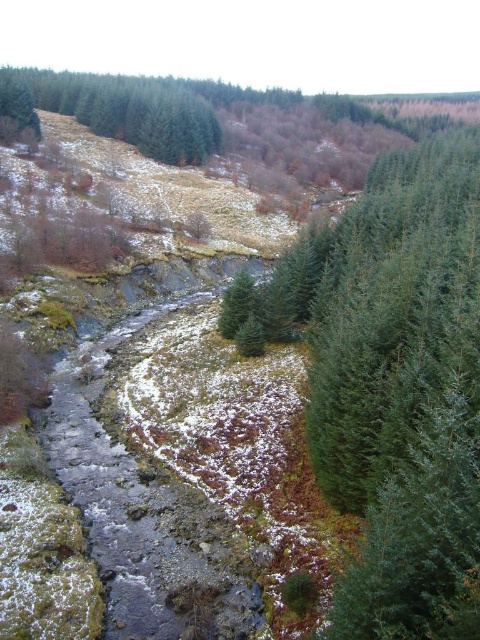
Is green needle-like tree at center-right above green matte tree at upper left?

No, green needle-like tree at center-right is not above green matte tree at upper left.

Is point (436, 413) farther from camera compared to point (36, 72)?

No.

Is point (432, 346) positioned behind point (216, 132)?

No, it is in front of (216, 132).

Identify the location of green needle-like tree at center-right. (395, 384).